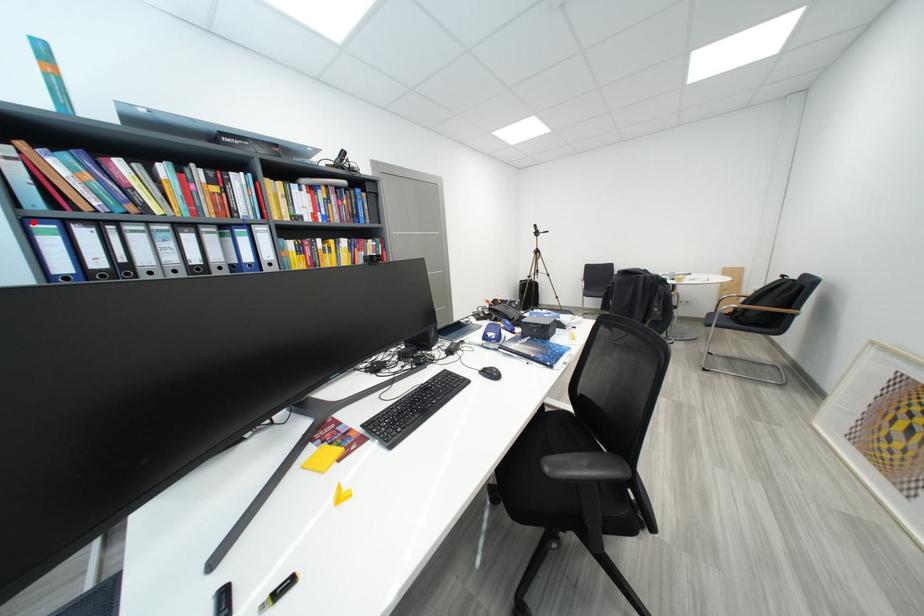
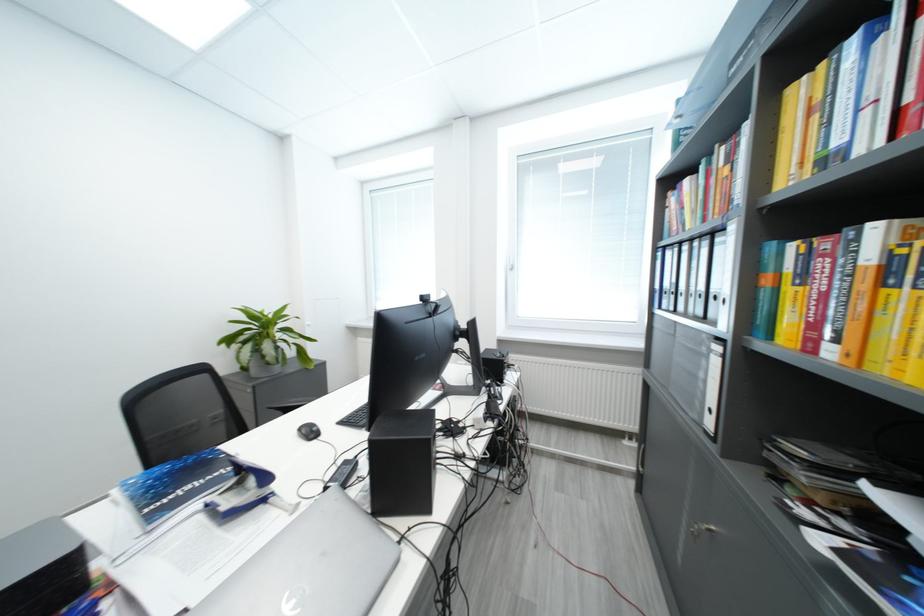
In the second image, find the point that corresponds to the highlighted location in the first image.

(664, 253)